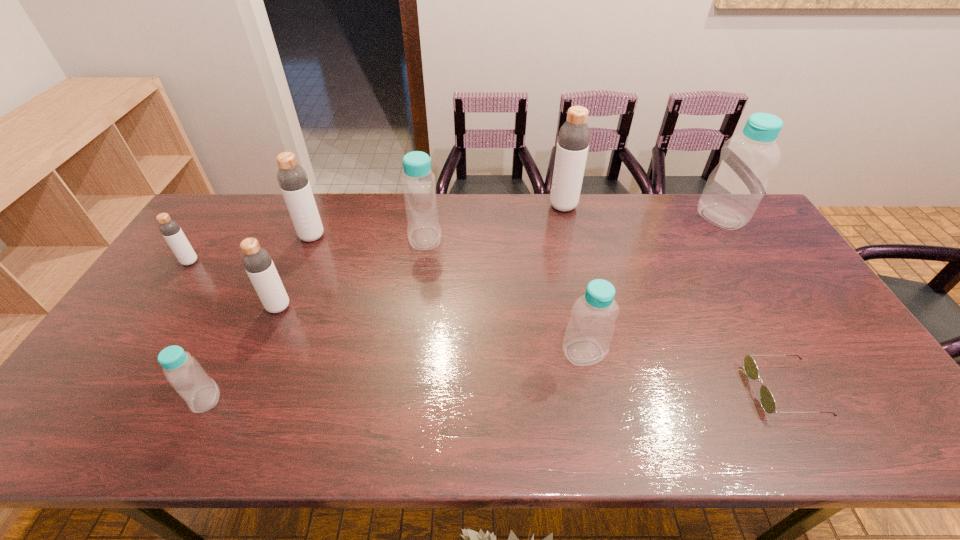
Locate an element on the screen. This screenshot has height=540, width=960. the second nearest bottle is located at coordinates (589, 332).

The width and height of the screenshot is (960, 540). Find the location of `the fifth farthest object`. the fifth farthest object is located at coordinates (170, 229).

Find the location of a particular element. the smallest gray bottle is located at coordinates (170, 229).

The width and height of the screenshot is (960, 540). In order to click on the nearest blue bottle in this screenshot , I will do `click(185, 374)`.

At what (x,y) coordinates should I click in order to perform the action: click on the second object from left to right. Please return your answer as a coordinate pair (x, y). This screenshot has height=540, width=960. Looking at the image, I should click on (185, 374).

I want to click on the shortest object, so click(767, 401).

You are a GUI agent. You are given a task and a screenshot of the screen. Output one action in this format:
    pyautogui.click(x=<x>, y=<y>)
    Task: Click on the sunglasses
    The width and height of the screenshot is (960, 540).
    Given the screenshot: What is the action you would take?
    [x=767, y=401]

Identify the location of vacant region located 0.050m on the left of the farthest gray bottle. (536, 206).

You are a GUI agent. You are given a task and a screenshot of the screen. Output one action in this format:
    pyautogui.click(x=<x>, y=<y>)
    Task: Click on the vacant space positioned 0.290m on the left of the biggest blue bottle
    This screenshot has height=540, width=960.
    Given the screenshot: What is the action you would take?
    pyautogui.click(x=615, y=217)

Image resolution: width=960 pixels, height=540 pixels. In order to click on free spot located 0.300m on the left of the third blue bottle from right to left in this screenshot , I will do `click(317, 238)`.